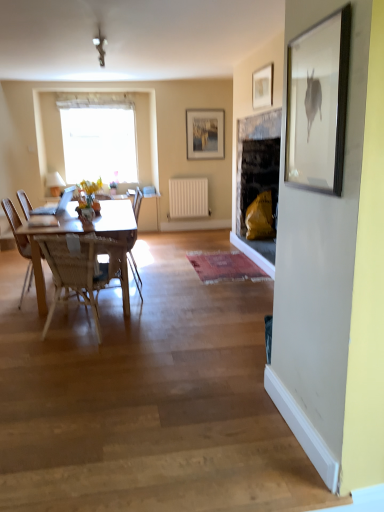
Question: Does white sheer curtain at upper center have a lesser width compared to matte glass picture frame at upper center, which appears as the first picture frame when viewed from the back?

Choices:
 (A) no
 (B) yes

Answer: (A)

Question: Considering the relative positions of white sheer curtain at upper center and matte glass picture frame at upper center, marked as the first picture frame in a left-to-right arrangement, in the image provided, is white sheer curtain at upper center behind matte glass picture frame at upper center, marked as the first picture frame in a left-to-right arrangement,?

Choices:
 (A) yes
 (B) no

Answer: (B)

Question: Can you confirm if white sheer curtain at upper center is shorter than matte glass picture frame at upper center, marked as the first picture frame in a left-to-right arrangement?

Choices:
 (A) yes
 (B) no

Answer: (B)

Question: Is white sheer curtain at upper center taller than matte glass picture frame at upper center, marked as the first picture frame in a left-to-right arrangement?

Choices:
 (A) no
 (B) yes

Answer: (B)

Question: Is white sheer curtain at upper center located outside matte glass picture frame at upper center, which appears as the first picture frame when viewed from the back?

Choices:
 (A) no
 (B) yes

Answer: (B)

Question: From a real-world perspective, does white sheer curtain at upper center stand above matte glass picture frame at upper center, which appears as the first picture frame when viewed from the back?

Choices:
 (A) no
 (B) yes

Answer: (A)

Question: From the image's perspective, is matte glass picture frame at upper center, marked as the first picture frame in a left-to-right arrangement, located above matte glass vase at center?

Choices:
 (A) no
 (B) yes

Answer: (B)

Question: Is matte glass vase at center a part of matte glass picture frame at upper center, marked as the first picture frame in a left-to-right arrangement?

Choices:
 (A) no
 (B) yes

Answer: (A)

Question: Does matte glass picture frame at upper center, which appears as the first picture frame when viewed from the back, have a greater height compared to matte glass vase at center?

Choices:
 (A) no
 (B) yes

Answer: (B)

Question: From the image's perspective, is matte glass picture frame at upper center, the second picture frame from the front, under matte glass vase at center?

Choices:
 (A) no
 (B) yes

Answer: (A)

Question: Does matte glass picture frame at upper center, which appears as the first picture frame when viewed from the back, have a larger size compared to matte glass vase at center?

Choices:
 (A) yes
 (B) no

Answer: (A)

Question: Is matte glass picture frame at upper center, marked as the first picture frame in a left-to-right arrangement, further to the viewer compared to matte glass vase at center?

Choices:
 (A) no
 (B) yes

Answer: (B)

Question: Is white sheer curtain at upper center at the back of matte glass picture frame at upper center, which appears as the first picture frame when viewed from the back?

Choices:
 (A) yes
 (B) no

Answer: (B)